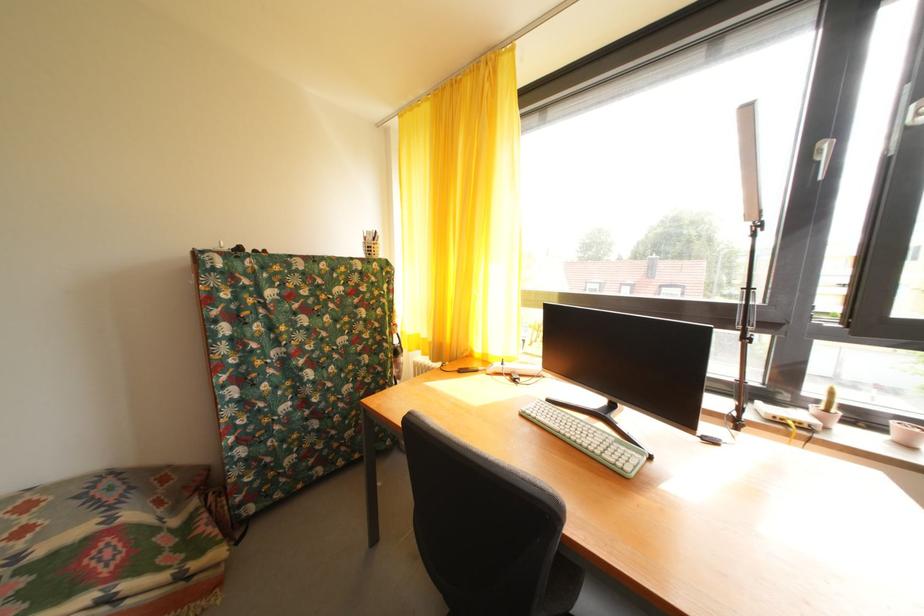
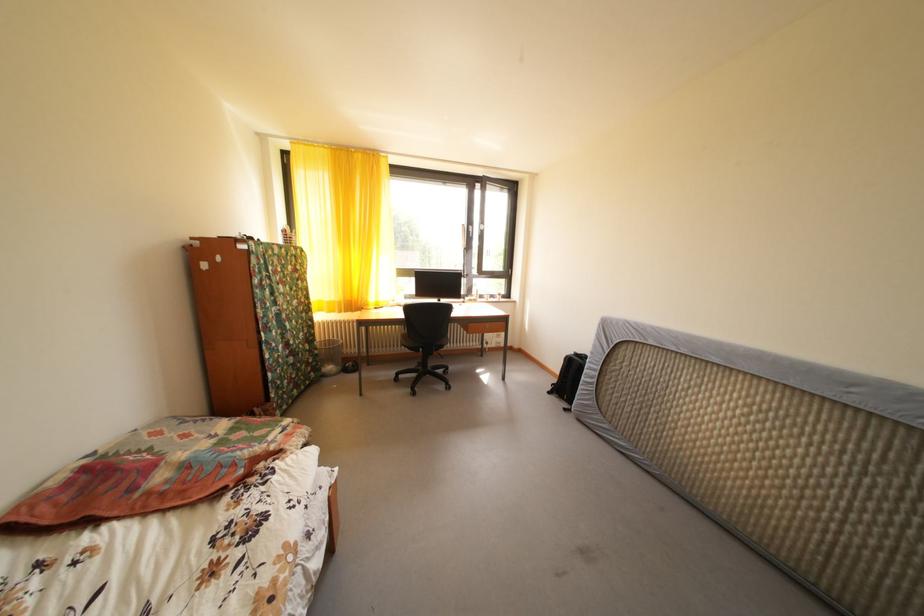
In the second image, find the point that corresponds to (x=31, y=538) in the first image.

(195, 442)